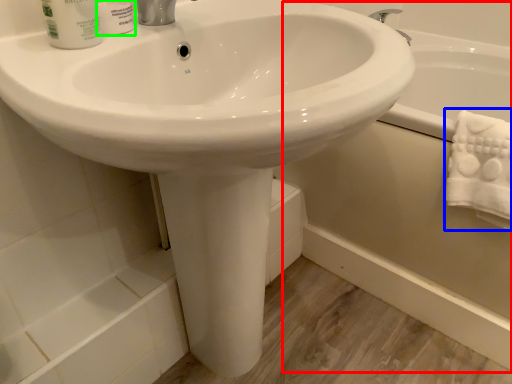
Question: Which object is positioned farthest from bath (highlighted by a red box)? Select from bath towel (highlighted by a blue box) and shaving cream (highlighted by a green box).

Choices:
 (A) bath towel
 (B) shaving cream

Answer: (B)